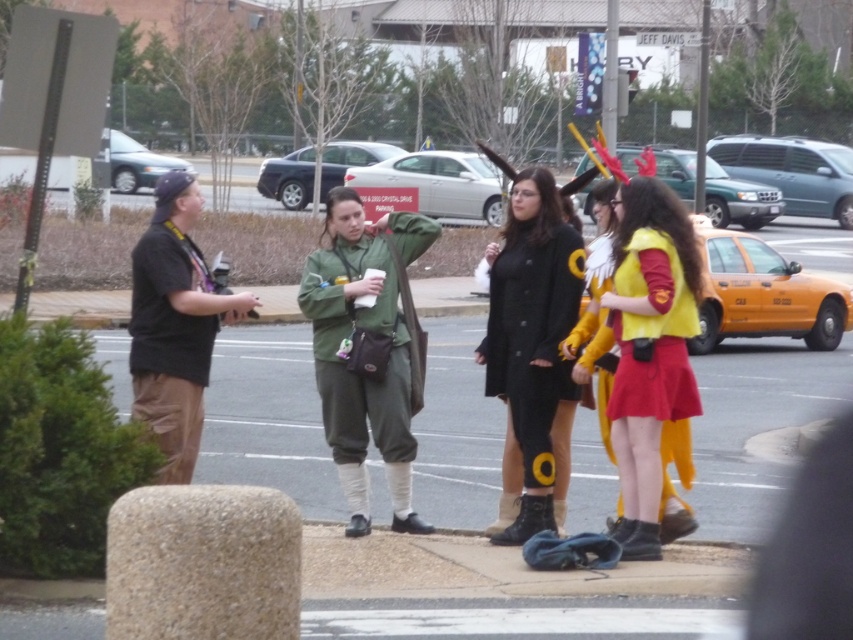
You are standing at the point with coordinates point (x=549, y=381) and want to move towards the street corner. There is a point (x=642, y=461) in your path. Will you have to go around it or can you walk straight ahead?

Point (x=642, y=461) is in front of point (x=549, y=381), so you will have to go around it to reach the street corner.

You are a costume designer observing the scene. You need to determine which costume is narrower between the yellow fabric costume at center and the black matte coat at center. Which one is narrower?

The yellow fabric costume at center is thinner than the black matte coat at center, so the yellow fabric costume at center is narrower.

You are a photographer trying to capture a photo of both the yellow fabric costume at center and the black matte coat at center. Since you want them both in the frame, which one should you position closer to the camera to ensure both are visible?

The yellow fabric costume at center is to the right of black matte coat at center, so positioning the black matte coat at center closer to the camera would allow the photographer to capture both in the frame since they are aligned horizontally.